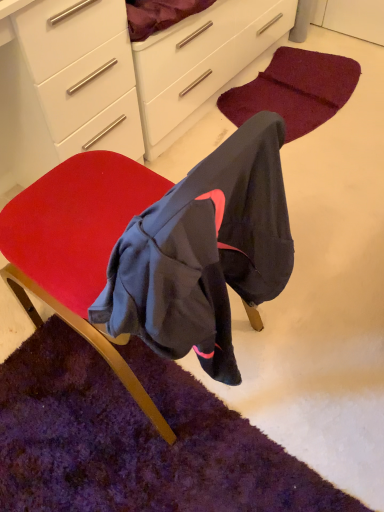
Question: Considering the positions of burgundy carpet at lower center, which is counted as the 1th mat, starting from the back, and purple shaggy rug at lower left, which is the 2th mat in back-to-front order, in the image, is burgundy carpet at lower center, which is counted as the 1th mat, starting from the back, bigger or smaller than purple shaggy rug at lower left, which is the 2th mat in back-to-front order,?

Choices:
 (A) small
 (B) big

Answer: (A)

Question: Do you think burgundy carpet at lower center, arranged as the first mat when viewed from the top, is within purple shaggy rug at lower left, the 1th mat in the bottom-to-top sequence, or outside of it?

Choices:
 (A) outside
 (B) inside

Answer: (A)

Question: Based on their relative distances, which object is farther from the white glossy chest of drawers at upper left?

Choices:
 (A) burgundy carpet at lower center, which is counted as the second mat, starting from the front
 (B) white glossy cabinet at upper center
 (C) velvet red chair at center
 (D) purple shaggy rug at lower left, acting as the 2th mat starting from the top

Answer: (A)

Question: Based on their relative distances, which object is farther from the velvet red chair at center?

Choices:
 (A) purple shaggy rug at lower left, the 1th mat in the bottom-to-top sequence
 (B) white glossy cabinet at upper center
 (C) burgundy carpet at lower center, the 2th mat from the bottom
 (D) white glossy chest of drawers at upper left

Answer: (C)